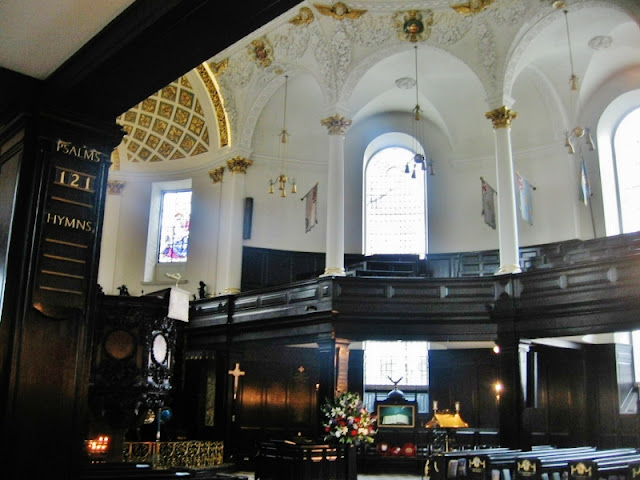
This screenshot has height=480, width=640. In order to click on column in this screenshot , I will do `click(336, 193)`, `click(504, 179)`.